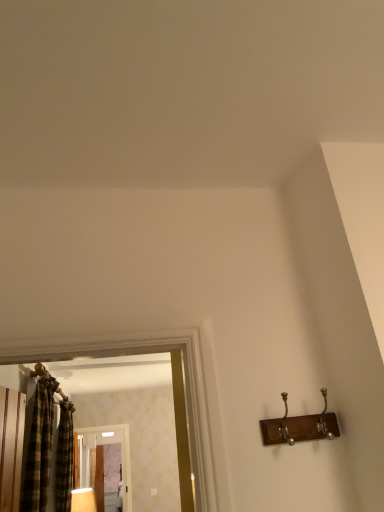
Question: Does plaid fabric shower curtain at left have a lesser width compared to matte wooden lamp at lower left?

Choices:
 (A) yes
 (B) no

Answer: (A)

Question: From a real-world perspective, is plaid fabric shower curtain at left physically above matte wooden lamp at lower left?

Choices:
 (A) yes
 (B) no

Answer: (A)

Question: Is plaid fabric shower curtain at left far away from matte wooden lamp at lower left?

Choices:
 (A) yes
 (B) no

Answer: (B)

Question: Is plaid fabric shower curtain at left at the left side of matte wooden lamp at lower left?

Choices:
 (A) yes
 (B) no

Answer: (A)

Question: Is plaid fabric shower curtain at left taller than matte wooden lamp at lower left?

Choices:
 (A) no
 (B) yes

Answer: (B)

Question: Is plaid fabric shower curtain at left at the right side of matte wooden lamp at lower left?

Choices:
 (A) no
 (B) yes

Answer: (A)

Question: Is clear glass screen door at center smaller than wooden hanger at upper left?

Choices:
 (A) yes
 (B) no

Answer: (B)

Question: Considering the relative positions of clear glass screen door at center and wooden hanger at upper left in the image provided, is clear glass screen door at center to the right of wooden hanger at upper left from the viewer's perspective?

Choices:
 (A) no
 (B) yes

Answer: (A)

Question: Is clear glass screen door at center wider than wooden hanger at upper left?

Choices:
 (A) no
 (B) yes

Answer: (A)

Question: From the image's perspective, would you say clear glass screen door at center is positioned over wooden hanger at upper left?

Choices:
 (A) yes
 (B) no

Answer: (B)

Question: Is clear glass screen door at center in contact with wooden hanger at upper left?

Choices:
 (A) yes
 (B) no

Answer: (B)

Question: From the image's perspective, is clear glass screen door at center under wooden hanger at upper left?

Choices:
 (A) no
 (B) yes

Answer: (B)

Question: Is plaid fabric shower curtain at left aimed at plaid fabric curtain at left?

Choices:
 (A) yes
 (B) no

Answer: (B)